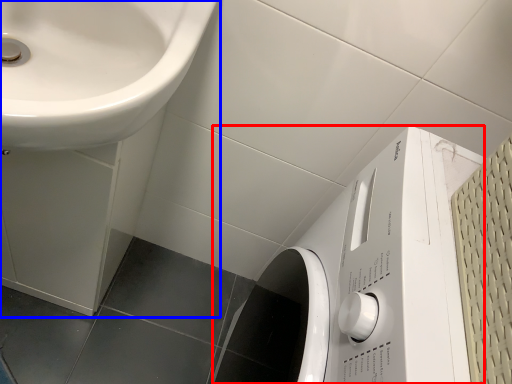
Question: Among these objects, which one is farthest to the camera, washing machine (highlighted by a red box) or sink (highlighted by a blue box)?

Choices:
 (A) washing machine
 (B) sink

Answer: (B)